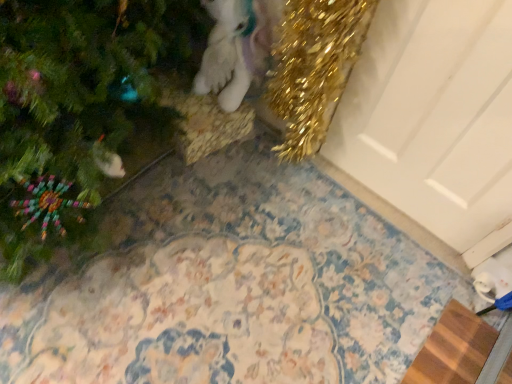
Measure the distance between point (482, 363) and camera.

A distance of 4.14 feet exists between point (482, 363) and camera.

Image resolution: width=512 pixels, height=384 pixels. What do you see at coordinates (237, 48) in the screenshot?
I see `white plush unicorn at upper center` at bounding box center [237, 48].

Identify the location of brown woven mat at lower right. The width and height of the screenshot is (512, 384). (453, 349).

Is white matte door at upper right facing away from brown woven mat at lower right?

white matte door at upper right does not have its back to brown woven mat at lower right.

Between white matte door at upper right and brown woven mat at lower right, which one has less height?

brown woven mat at lower right.

Identify the location of door that appears above the brown woven mat at lower right (from the image's perspective). This screenshot has width=512, height=384. (433, 115).

Considering their positions, is white matte door at upper right located in front of or behind brown woven mat at lower right?

white matte door at upper right is in front of brown woven mat at lower right.

Is point (430, 381) more distant than point (356, 155)?

No, (430, 381) is closer to viewer.

Can you tell me how much brown woven mat at lower right and white matte door at upper right differ in facing direction?

They differ by 90.3 degrees in their facing directions.

Is brown woven mat at lower right not inside white matte door at upper right?

Yes.

Considering the relative positions of brown woven mat at lower right and white matte door at upper right in the image provided, is brown woven mat at lower right to the left or to the right of white matte door at upper right?

Clearly, brown woven mat at lower right is on the right of white matte door at upper right in the image.

Considering the sizes of white plush unicorn at upper center and green matte christmas tree at upper left in the image, is white plush unicorn at upper center taller or shorter than green matte christmas tree at upper left?

Clearly, white plush unicorn at upper center is shorter compared to green matte christmas tree at upper left.

Does white plush unicorn at upper center appear on the left side of green matte christmas tree at upper left?

No, white plush unicorn at upper center is not to the left of green matte christmas tree at upper left.

Is white plush unicorn at upper center not close to green matte christmas tree at upper left?

No.

From a real-world perspective, is white matte door at upper right below white plush unicorn at upper center?

Actually, white matte door at upper right is physically above white plush unicorn at upper center in the real world.

From the image's perspective, is white matte door at upper right below white plush unicorn at upper center?

Yes, from the image's perspective, white matte door at upper right is below white plush unicorn at upper center.

In terms of width, does white matte door at upper right look wider or thinner when compared to white plush unicorn at upper center?

Clearly, white matte door at upper right has less width compared to white plush unicorn at upper center.

Are white matte door at upper right and white plush unicorn at upper center located far from each other?

They are positioned close to each other.

Is brown woven mat at lower right not inside white plush unicorn at upper center?

Yes, brown woven mat at lower right is located beyond the bounds of white plush unicorn at upper center.

From the image's perspective, which object appears higher, brown woven mat at lower right or white plush unicorn at upper center?

white plush unicorn at upper center.

Can you see brown woven mat at lower right touching white plush unicorn at upper center?

No.

Can you confirm if brown woven mat at lower right is bigger than white plush unicorn at upper center?

Actually, brown woven mat at lower right might be smaller than white plush unicorn at upper center.

Which point is more forward, (378, 7) or (10, 276)?

Point (10, 276)

The width and height of the screenshot is (512, 384). In order to click on christmas tree that is above the white matte door at upper right (from a real-world perspective) in this screenshot , I will do `click(82, 109)`.

Which object is further away from the camera, white matte door at upper right or green matte christmas tree at upper left?

white matte door at upper right is more distant.

Between green matte christmas tree at upper left and white plush unicorn at upper center, which one has less height?

white plush unicorn at upper center.

Is green matte christmas tree at upper left located outside white plush unicorn at upper center?

Absolutely, green matte christmas tree at upper left is external to white plush unicorn at upper center.

How many degrees apart are the facing directions of green matte christmas tree at upper left and white plush unicorn at upper center?

1.48 degrees.

The width and height of the screenshot is (512, 384). Find the location of `doormat directly beneath the white matte door at upper right (from a real-world perspective)`. doormat directly beneath the white matte door at upper right (from a real-world perspective) is located at coordinates (453, 349).

Identify the location of doormat on the right of the white matte door at upper right. (453, 349).

Based on the photo, considering their positions, is green matte christmas tree at upper left positioned closer to brown woven mat at lower right than white matte door at upper right?

Based on the image, white matte door at upper right appears to be nearer to brown woven mat at lower right.

Considering their positions, is white plush unicorn at upper center positioned closer to white matte door at upper right than brown woven mat at lower right?

Based on the image, white plush unicorn at upper center appears to be nearer to white matte door at upper right.

When comparing their distances from green matte christmas tree at upper left, does white plush unicorn at upper center or brown woven mat at lower right seem closer?

white plush unicorn at upper center.

From the image, which object appears to be farther from white plush unicorn at upper center, green matte christmas tree at upper left or white matte door at upper right?

white matte door at upper right.

From the image, which object appears to be nearer to brown woven mat at lower right, white plush unicorn at upper center or white matte door at upper right?

white matte door at upper right lies closer to brown woven mat at lower right than the other object.

Looking at the image, which one is located closer to white plush unicorn at upper center, brown woven mat at lower right or green matte christmas tree at upper left?

green matte christmas tree at upper left lies closer to white plush unicorn at upper center than the other object.

From the image, which object appears to be farther from white matte door at upper right, green matte christmas tree at upper left or brown woven mat at lower right?

green matte christmas tree at upper left lies further to white matte door at upper right than the other object.

From the image, which object appears to be farther from white plush unicorn at upper center, green matte christmas tree at upper left or brown woven mat at lower right?

The object further to white plush unicorn at upper center is brown woven mat at lower right.

Find the location of `animal between green matte christmas tree at upper left and white matte door at upper right`. animal between green matte christmas tree at upper left and white matte door at upper right is located at coordinates (237, 48).

You are a GUI agent. You are given a task and a screenshot of the screen. Output one action in this format:
    pyautogui.click(x=<x>, y=<y>)
    Task: Click on the door between green matte christmas tree at upper left and brown woven mat at lower right
    
    Given the screenshot: What is the action you would take?
    pyautogui.click(x=433, y=115)

Locate an element on the screen. Image resolution: width=512 pixels, height=384 pixels. animal located between green matte christmas tree at upper left and brown woven mat at lower right in the left-right direction is located at coordinates (237, 48).

I want to click on door that lies between white plush unicorn at upper center and brown woven mat at lower right from top to bottom, so click(x=433, y=115).